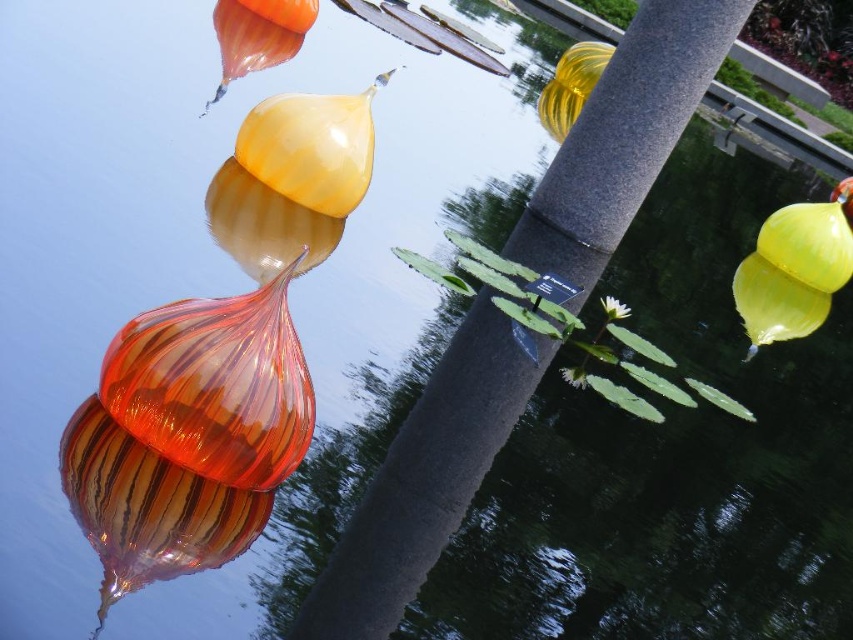
Question: Which of the following is the closest to the observer?

Choices:
 (A) white glossy flower at center
 (B) translucent amber glass vase at center
 (C) white matte flower at center

Answer: (B)

Question: Does white matte flower at center have a lesser width compared to white glossy flower at center?

Choices:
 (A) no
 (B) yes

Answer: (A)

Question: Which point is farther to the camera?

Choices:
 (A) (316, 248)
 (B) (618, 301)
 (C) (579, 376)

Answer: (B)

Question: Which of these objects is positioned farthest from the translucent amber glass vase at center?

Choices:
 (A) white matte flower at center
 (B) white glossy flower at center

Answer: (A)

Question: Does translucent amber glass vase at center have a greater width compared to white matte flower at center?

Choices:
 (A) yes
 (B) no

Answer: (A)

Question: Observing the image, what is the correct spatial positioning of translucent amber glass vase at center in reference to white matte flower at center?

Choices:
 (A) right
 (B) left

Answer: (B)